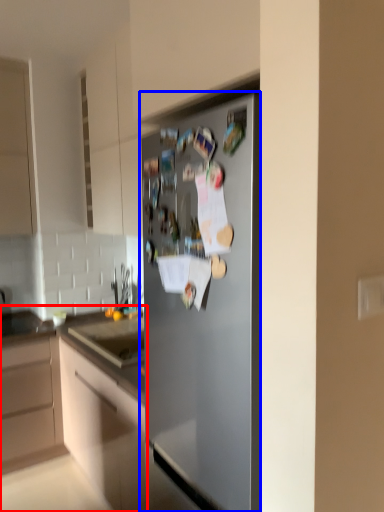
Question: Which object is further to the camera taking this photo, cabinetry (highlighted by a red box) or refrigerator (highlighted by a blue box)?

Choices:
 (A) cabinetry
 (B) refrigerator

Answer: (A)